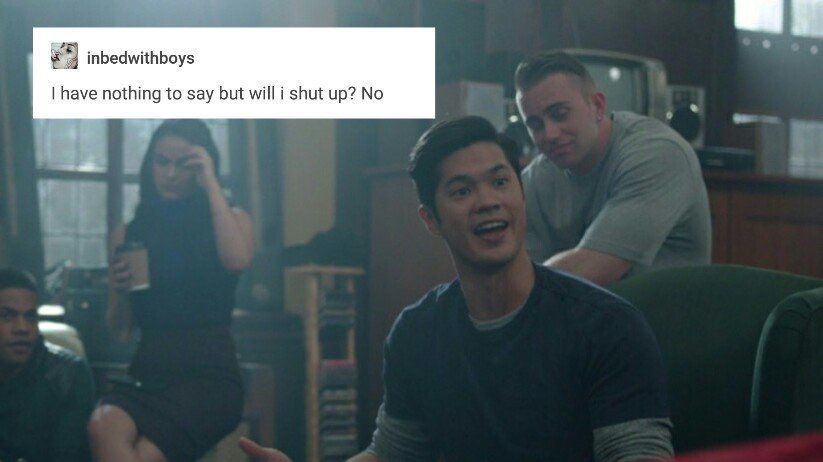
Where is `light coming from windows`? light coming from windows is located at coordinates (81, 154), (744, 16).